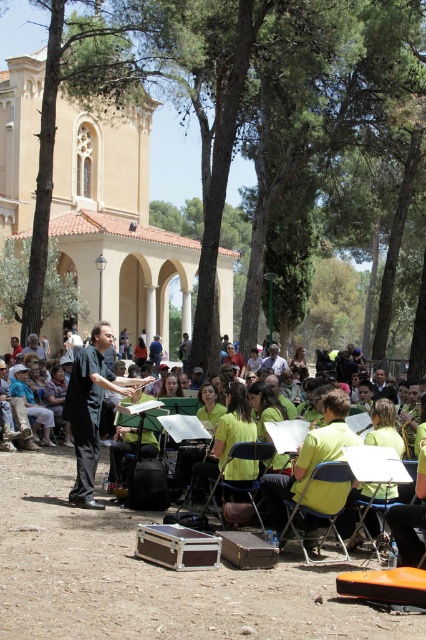
Can you confirm if green leafy tree at center is positioned below yellow fabric chair at center?

No.

The image size is (426, 640). I want to click on green leafy tree at center, so click(x=290, y=120).

Who is more forward, [42,116] or [256,451]?

Point [256,451] is more forward.

The image size is (426, 640). What are the coordinates of `green leafy tree at center` in the screenshot? It's located at (290, 120).

I want to click on black smooth conductor at center, so click(91, 410).

Does black smooth conductor at center lie in front of yellow fabric chair at lower center?

That is False.

Locate an element on the screen. The width and height of the screenshot is (426, 640). black smooth conductor at center is located at coordinates (91, 410).

Based on the photo, does green leafy tree at center appear on the right side of yellow fabric chair at lower center?

Incorrect, green leafy tree at center is not on the right side of yellow fabric chair at lower center.

Is green leafy tree at center positioned in front of yellow fabric chair at lower center?

No, it is not.

Which is behind, point (242, 92) or point (296, 534)?

Positioned behind is point (242, 92).

This screenshot has width=426, height=640. In order to click on green leafy tree at center in this screenshot , I will do `click(290, 120)`.